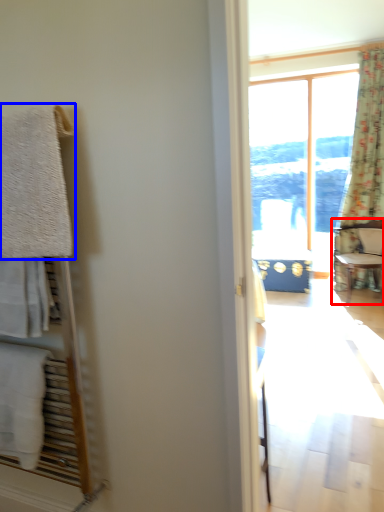
Question: Which object appears closest to the camera in this image, chair (highlighted by a red box) or towel/napkin (highlighted by a blue box)?

Choices:
 (A) chair
 (B) towel/napkin

Answer: (B)